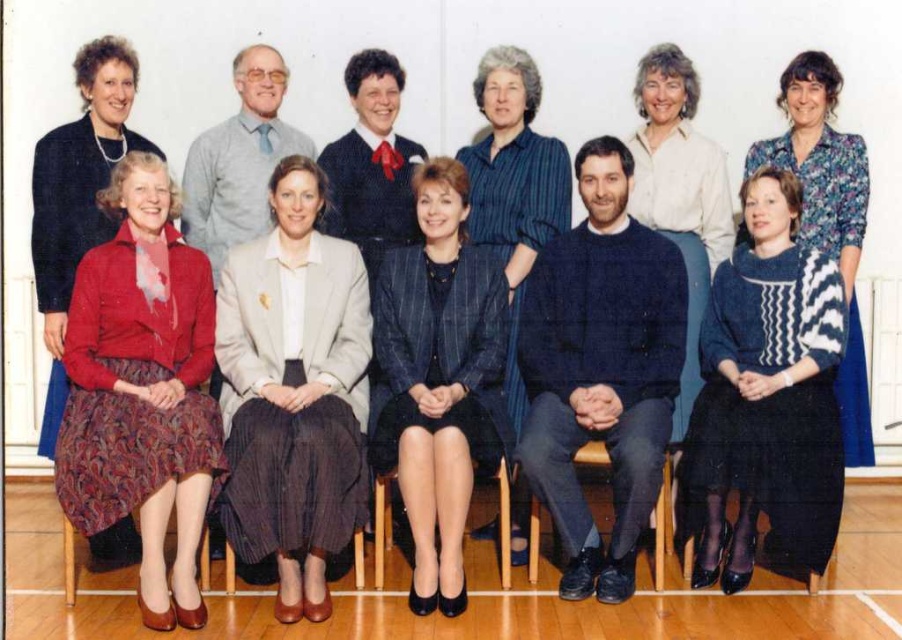
You are organizing a photo shoot and need to ensure that two specific participants, the person wearing the matte red sweater at lower left and the one in the blue striped shirt at center, can fit side by side in a new arrangement. Based on their current positions and the information provided, do you think they can fit without overlapping?

The matte red sweater at lower left might be wider than blue striped shirt at center, so there is a possibility they might overlap if placed side by side. It would be safer to leave extra space between them to avoid overlapping.

You are a photographer standing 1.5 meters away from the camera. You want to adjust the light beige fabric blazer at center so that it is closer to the camera. How much distance do you need to move it forward?

The light beige fabric blazer at center and camera are 3.50 meters apart. To move it closer by 1.5 meters, the blazer needs to be moved forward to 2.0 meters away from the camera.

You are a photographer holding a camera and want to take a photo of the light beige fabric blazer at center. Can you capture it clearly from your current position?

The light beige fabric blazer at center and camera are 3.50 meters apart, so yes, you can capture it clearly from your current position as the distance is within a typical clear capture range.